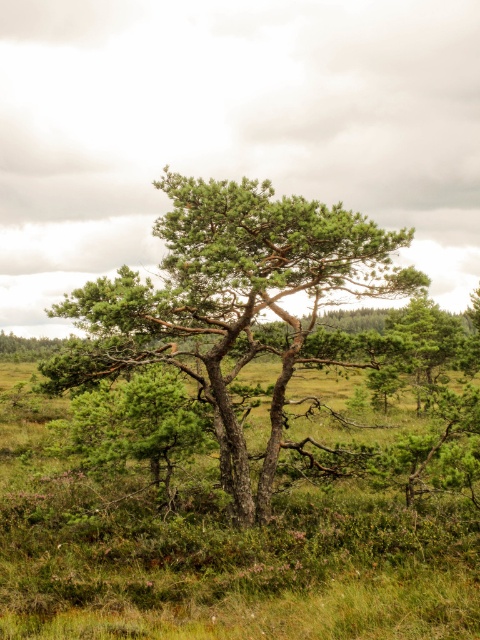
Between green textured tree at center and green matte tree at center, which one appears on the left side from the viewer's perspective?

Positioned to the left is green textured tree at center.

Can you confirm if green textured tree at center is shorter than green matte tree at center?

Incorrect, green textured tree at center's height does not fall short of green matte tree at center's.

Measure the distance between green textured tree at center and camera.

They are 8.64 meters apart.

What are the coordinates of `green textured tree at center` in the screenshot? It's located at (230, 305).